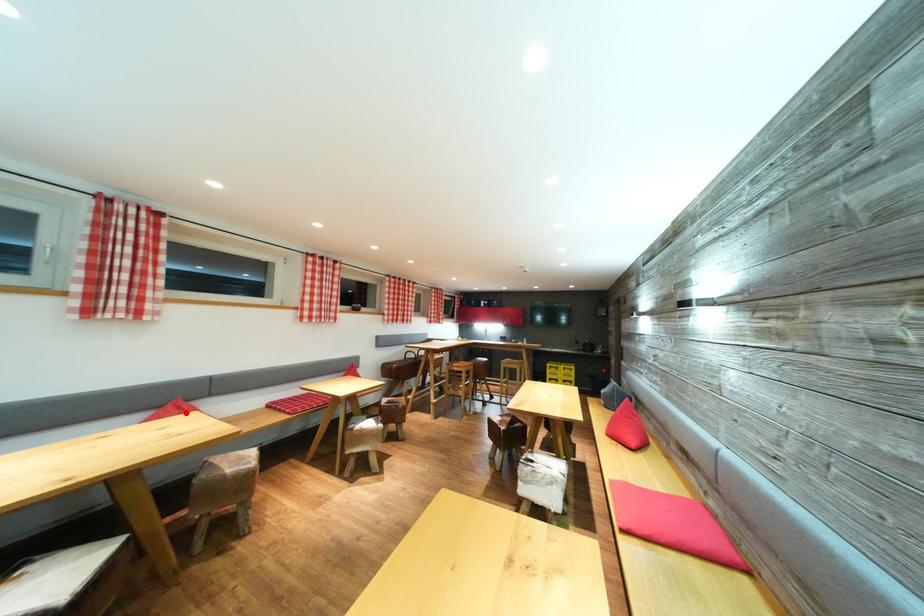
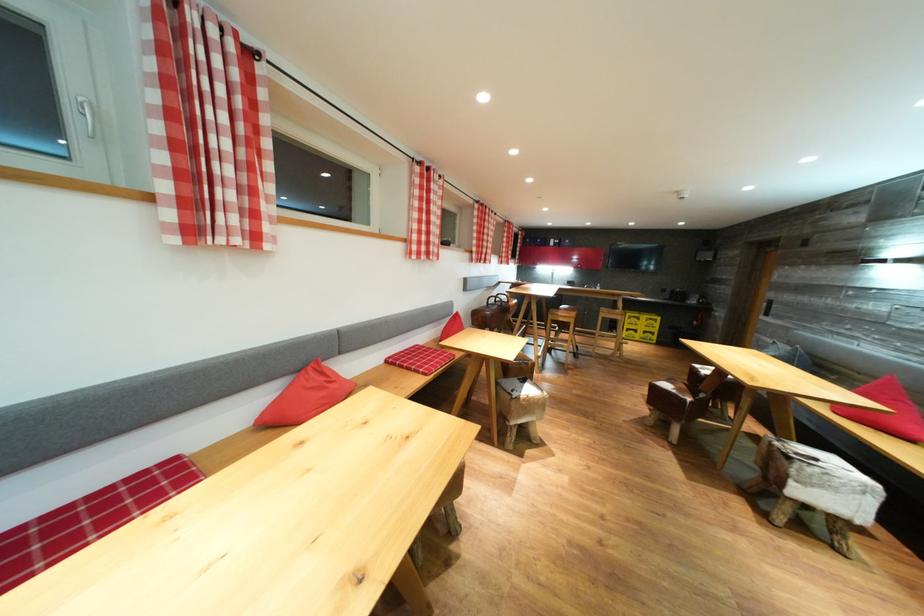
Where in the second image is the point corresponding to the highlighted location from the first image?

(330, 378)